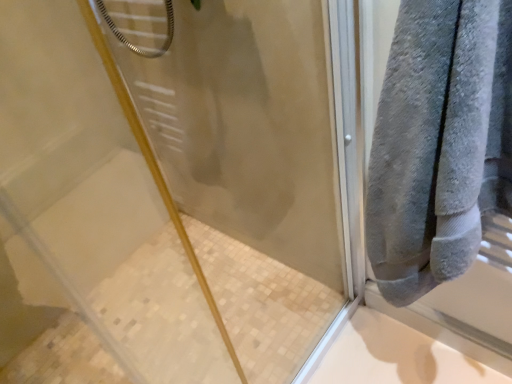
Question: Based on their positions, is transparent glass shower door at upper right located to the left or right of gray soft towel at right?

Choices:
 (A) right
 (B) left

Answer: (B)

Question: Is transparent glass shower door at upper right bigger or smaller than gray soft towel at right?

Choices:
 (A) big
 (B) small

Answer: (A)

Question: Choose the correct answer: Is transparent glass shower door at upper right inside gray soft towel at right or outside it?

Choices:
 (A) outside
 (B) inside

Answer: (A)

Question: From a real-world perspective, is gray soft towel at right positioned above or below transparent glass shower door at upper right?

Choices:
 (A) below
 (B) above

Answer: (B)

Question: From the image's perspective, is gray soft towel at right located above or below transparent glass shower door at upper right?

Choices:
 (A) above
 (B) below

Answer: (A)

Question: Looking at their shapes, would you say gray soft towel at right is wider or thinner than transparent glass shower door at upper right?

Choices:
 (A) thin
 (B) wide

Answer: (B)

Question: Considering the positions of gray soft towel at right and transparent glass shower door at upper right in the image, is gray soft towel at right taller or shorter than transparent glass shower door at upper right?

Choices:
 (A) short
 (B) tall

Answer: (A)